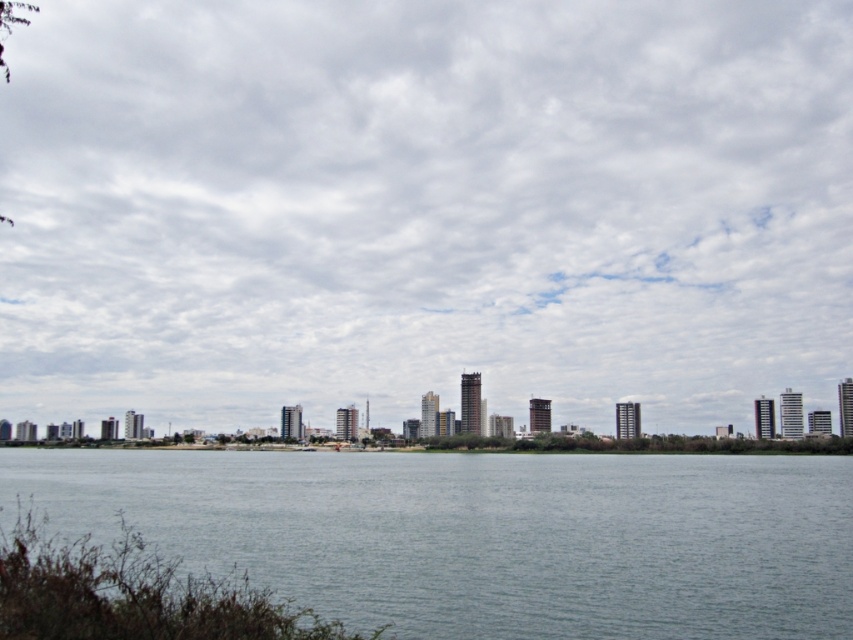
Question: Does cloudy sky at upper center lie in front of green leafy shrub at lower left?

Choices:
 (A) no
 (B) yes

Answer: (A)

Question: Among these points, which one is nearest to the camera?

Choices:
 (A) (138, 627)
 (B) (567, 188)
 (C) (234, 461)

Answer: (A)

Question: Is cloudy sky at upper center positioned behind green leafy shrub at lower left?

Choices:
 (A) yes
 (B) no

Answer: (A)

Question: Among these objects, which one is farthest from the camera?

Choices:
 (A) cloudy sky at upper center
 (B) gray water at center

Answer: (A)

Question: Which object is positioned closest to the cloudy sky at upper center?

Choices:
 (A) gray water at center
 (B) green leafy shrub at lower left

Answer: (A)

Question: Does gray water at center come in front of green leafy shrub at lower left?

Choices:
 (A) yes
 (B) no

Answer: (B)